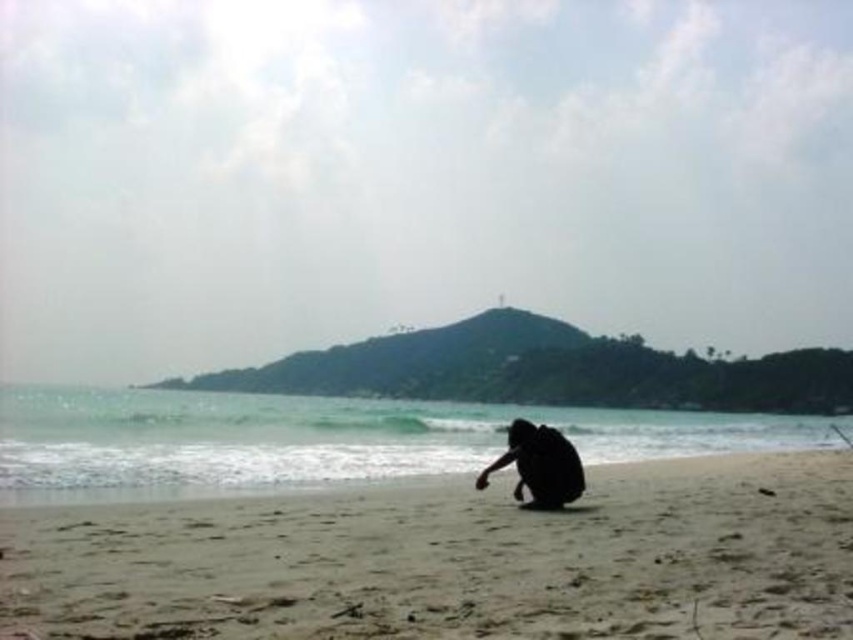
Question: Among these objects, which one is farthest from the camera?

Choices:
 (A) black matte person at center
 (B) sandy beach at lower center

Answer: (A)

Question: Is sandy beach at lower center closer to camera compared to black matte person at center?

Choices:
 (A) yes
 (B) no

Answer: (A)

Question: Does sandy beach at lower center appear on the left side of black matte person at center?

Choices:
 (A) yes
 (B) no

Answer: (B)

Question: Among these objects, which one is nearest to the camera?

Choices:
 (A) black matte person at center
 (B) sandy beach at lower center

Answer: (B)

Question: In this image, where is sandy beach at lower center located relative to black matte person at center?

Choices:
 (A) below
 (B) above

Answer: (A)